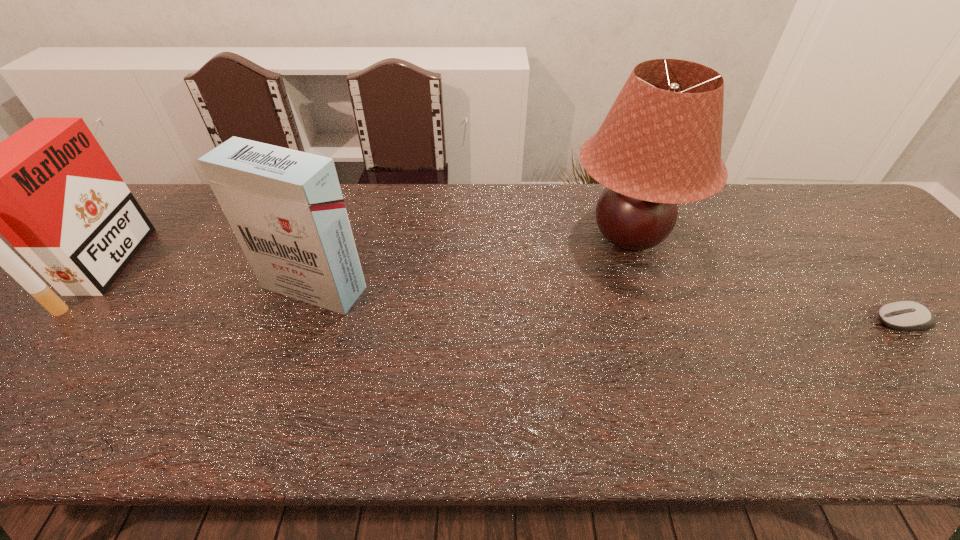
The height and width of the screenshot is (540, 960). Identify the location of lampshade. (660, 144).

The width and height of the screenshot is (960, 540). I want to click on the second object from right to left, so 660,144.

Image resolution: width=960 pixels, height=540 pixels. In order to click on the right cigarette case in this screenshot , I will do `click(285, 207)`.

The image size is (960, 540). I want to click on the leftmost object, so click(x=49, y=189).

Locate an element on the screen. The image size is (960, 540). the shortest object is located at coordinates (903, 315).

This screenshot has width=960, height=540. Identify the location of computer equipment. (903, 315).

This screenshot has height=540, width=960. Find the location of `vacant point located 0.250m on the front-facing side of the second object from right to left`. vacant point located 0.250m on the front-facing side of the second object from right to left is located at coordinates (476, 235).

Find the location of a particular element. The width and height of the screenshot is (960, 540). vacant space situated on the front-facing side of the second object from right to left is located at coordinates (484, 235).

The height and width of the screenshot is (540, 960). In order to click on vacant position located on the front-facing side of the second object from right to left in this screenshot , I will do `click(531, 235)`.

The image size is (960, 540). What are the coordinates of `vacant position located 0.150m on the front of the second object from left to right` in the screenshot? It's located at (284, 371).